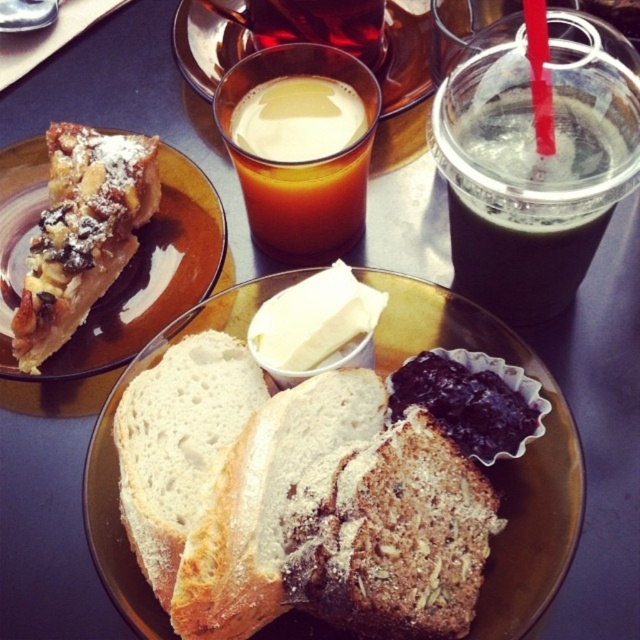
Question: Which of the following is the farthest from the observer?

Choices:
 (A) slightly toasted bread at center
 (B) powdered white bread at center
 (C) white soft bread at center

Answer: (C)

Question: Can you confirm if powdery brown pastry at upper left is positioned below golden liquid at center?

Choices:
 (A) yes
 (B) no

Answer: (A)

Question: Is powdered white bread at center behind powdery brown pastry at upper left?

Choices:
 (A) yes
 (B) no

Answer: (B)

Question: Which point is closer to the camera?

Choices:
 (A) powdered white bread at center
 (B) powdered brown bread at center
 (C) brown liquid at upper center

Answer: (B)

Question: Among these objects, which one is nearest to the camera?

Choices:
 (A) golden liquid at center
 (B) dark purple jam at center
 (C) powdery brown pastry at upper left
 (D) powdered white bread at center

Answer: (D)

Question: Is powdered brown bread at center thinner than dark purple jam at center?

Choices:
 (A) no
 (B) yes

Answer: (A)